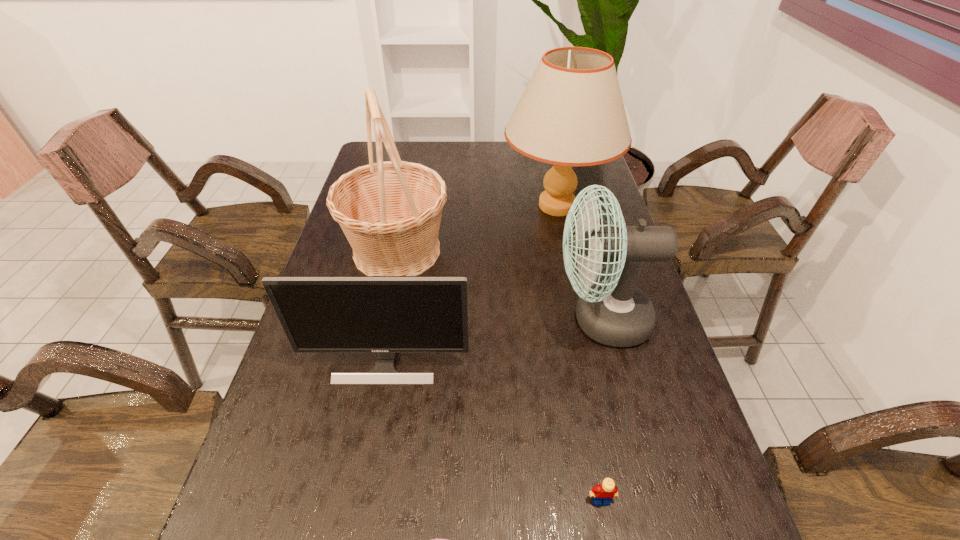
Locate an element on the screen. free space at the far right corner of the desktop is located at coordinates (589, 172).

The width and height of the screenshot is (960, 540). What are the coordinates of `vacant space that is in between the basket and the fan` in the screenshot? It's located at (499, 285).

The width and height of the screenshot is (960, 540). I want to click on empty location between the basket and the lampshade, so click(x=477, y=228).

This screenshot has height=540, width=960. Identify the location of vacant area that lies between the lampshade and the basket. (477, 228).

The width and height of the screenshot is (960, 540). I want to click on free space between the monitor and the Lego, so click(x=493, y=431).

At what (x,y) coordinates should I click in order to perform the action: click on vacant area that lies between the lampshade and the basket. Please return your answer as a coordinate pair (x, y). The height and width of the screenshot is (540, 960). Looking at the image, I should click on (477, 228).

At what (x,y) coordinates should I click in order to perform the action: click on object that stands as the third closest to the lampshade. Please return your answer as a coordinate pair (x, y). The width and height of the screenshot is (960, 540). Looking at the image, I should click on (386, 315).

Find the location of a particular element. The image size is (960, 540). the closest object to the shortest object is located at coordinates coord(603,493).